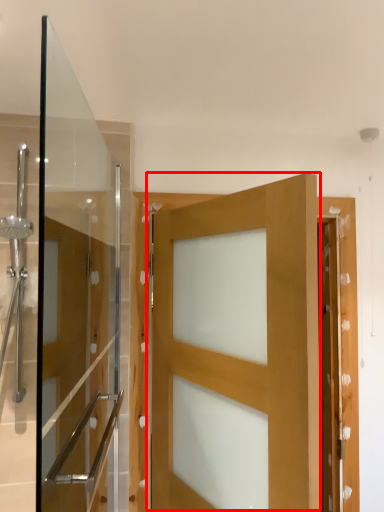
Question: From the image's perspective, where is door (annotated by the red box) located relative to screen door?

Choices:
 (A) below
 (B) above

Answer: (A)